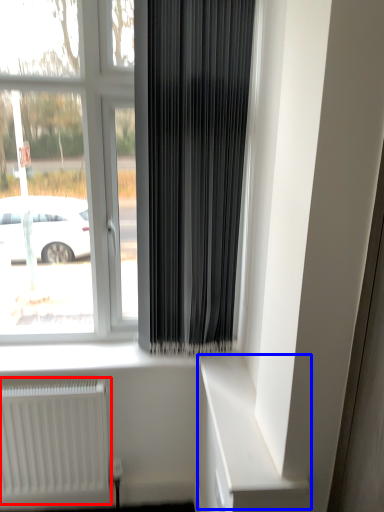
Question: Which object is further to the camera taking this photo, radiator (highlighted by a red box) or shelf (highlighted by a blue box)?

Choices:
 (A) radiator
 (B) shelf

Answer: (A)